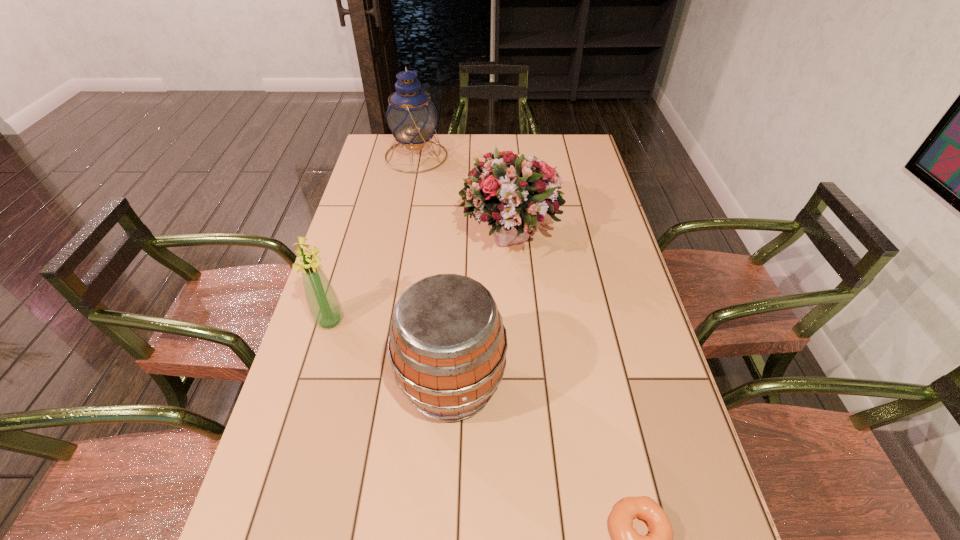
Find the location of a particular element. Image resolution: width=960 pixels, height=540 pixels. the tallest object is located at coordinates (411, 117).

Locate an element on the screen. the farthest object is located at coordinates (411, 117).

The image size is (960, 540). I want to click on the right bouquet, so click(515, 191).

This screenshot has width=960, height=540. In order to click on the second farthest object in this screenshot , I will do `click(515, 191)`.

Locate an element on the screen. This screenshot has height=540, width=960. the left bouquet is located at coordinates (324, 306).

Image resolution: width=960 pixels, height=540 pixels. What are the coordinates of `the third nearest object` in the screenshot? It's located at (324, 306).

Identify the location of the second nearest object. (447, 344).

Locate an element on the screen. vacant space located on the front-facing side of the lantern is located at coordinates (470, 156).

At what (x,y) coordinates should I click in order to perform the action: click on free space located 0.330m on the front of the fourth nearest object. Please return your answer as a coordinate pair (x, y). Image resolution: width=960 pixels, height=540 pixels. Looking at the image, I should click on (518, 378).

I want to click on vacant region located on the front-facing side of the left bouquet, so [316, 369].